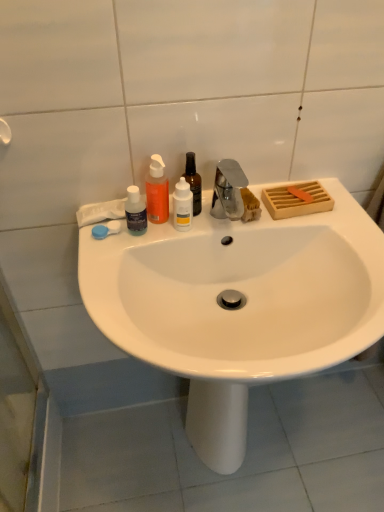
Question: Is translucent orange liquid at upper center, which is the third bottle in right-to-left order, shorter than matte black bottle at left, which is the 1th bottle in left-to-right order?

Choices:
 (A) no
 (B) yes

Answer: (A)

Question: Is translucent orange liquid at upper center, which is the third bottle in right-to-left order, completely or partially outside of matte black bottle at left, the 4th bottle positioned from the right?

Choices:
 (A) no
 (B) yes

Answer: (B)

Question: Can you confirm if translucent orange liquid at upper center, which is counted as the second bottle, starting from the left, is wider than matte black bottle at left, which is the 1th bottle in left-to-right order?

Choices:
 (A) no
 (B) yes

Answer: (B)

Question: Considering the relative positions of translucent orange liquid at upper center, which is the third bottle in right-to-left order, and matte black bottle at left, the 4th bottle positioned from the right, in the image provided, is translucent orange liquid at upper center, which is the third bottle in right-to-left order, to the right of matte black bottle at left, the 4th bottle positioned from the right, from the viewer's perspective?

Choices:
 (A) no
 (B) yes

Answer: (B)

Question: Could matte black bottle at left, the 4th bottle positioned from the right, be considered to be inside translucent orange liquid at upper center, which is counted as the second bottle, starting from the left?

Choices:
 (A) no
 (B) yes

Answer: (A)

Question: From the image's perspective, is translucent orange liquid at upper center, which is counted as the second bottle, starting from the left, located beneath matte black bottle at left, the 4th bottle positioned from the right?

Choices:
 (A) yes
 (B) no

Answer: (B)

Question: Is white matte bottle at center, which is counted as the 3th bottle, starting from the left, oriented towards translucent orange liquid at upper center, which is the third bottle in right-to-left order?

Choices:
 (A) yes
 (B) no

Answer: (B)

Question: From the image's perspective, does white matte bottle at center, which is counted as the 3th bottle, starting from the left, appear higher than translucent orange liquid at upper center, which is counted as the second bottle, starting from the left?

Choices:
 (A) yes
 (B) no

Answer: (B)

Question: Can you confirm if white matte bottle at center, which is counted as the second bottle, starting from the right, is wider than translucent orange liquid at upper center, which is counted as the second bottle, starting from the left?

Choices:
 (A) no
 (B) yes

Answer: (B)

Question: From a real-world perspective, is white matte bottle at center, which is counted as the second bottle, starting from the right, under translucent orange liquid at upper center, which is counted as the second bottle, starting from the left?

Choices:
 (A) yes
 (B) no

Answer: (A)

Question: Is white matte bottle at center, which is counted as the 3th bottle, starting from the left, positioned behind translucent orange liquid at upper center, which is the third bottle in right-to-left order?

Choices:
 (A) no
 (B) yes

Answer: (B)

Question: From a real-world perspective, is white matte bottle at center, which is counted as the second bottle, starting from the right, located higher than translucent orange liquid at upper center, which is counted as the second bottle, starting from the left?

Choices:
 (A) no
 (B) yes

Answer: (A)

Question: From a real-world perspective, does blue plastic soap at left sit lower than white matte bottle at center, which is counted as the second bottle, starting from the right?

Choices:
 (A) yes
 (B) no

Answer: (A)